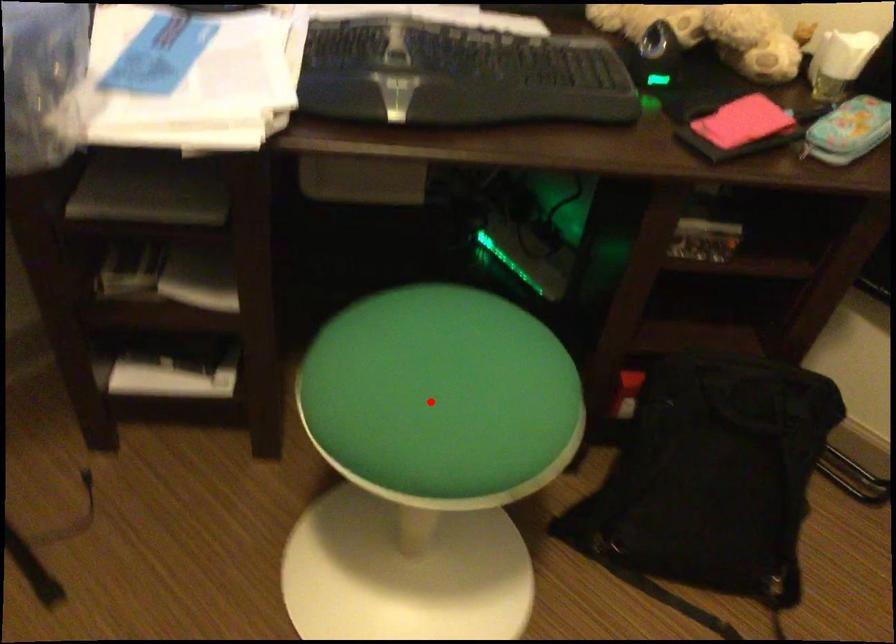
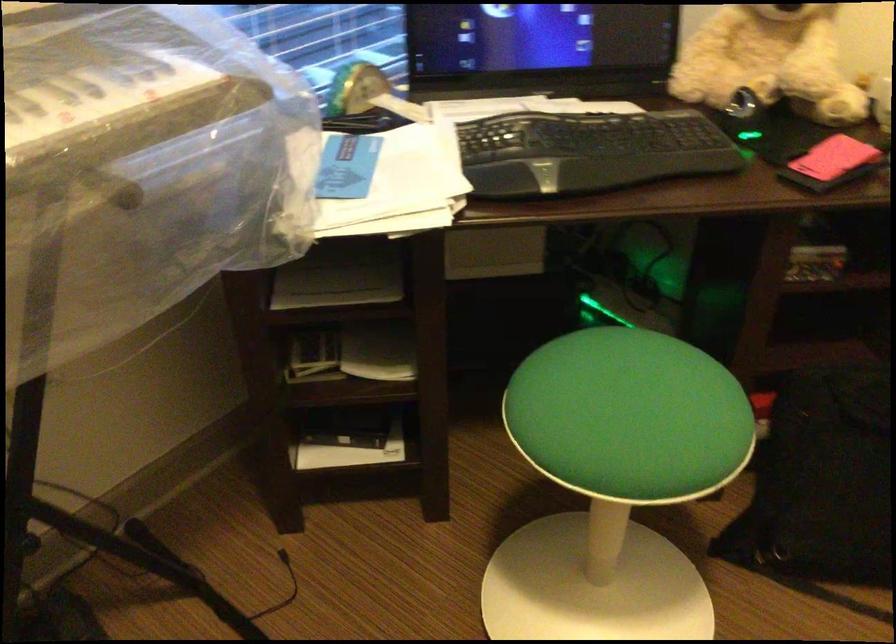
Find the pixel in the second image that matches the highlighted location in the first image.

(629, 415)